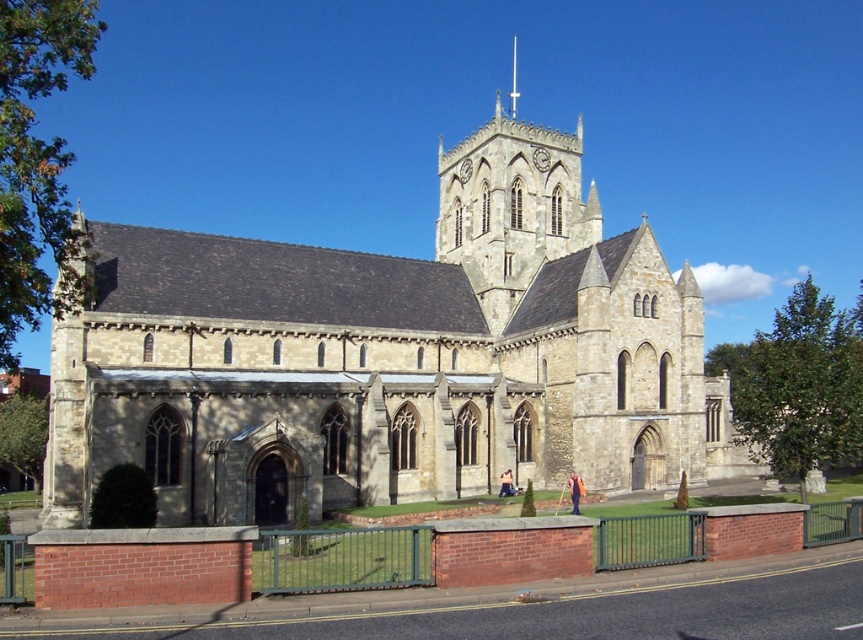
You are standing at the point with coordinates (x=389, y=356) in the image. What object are you directly facing?

The point at coordinates (x=389, y=356) corresponds to the stone church at center, so you are directly facing the stone church at center.